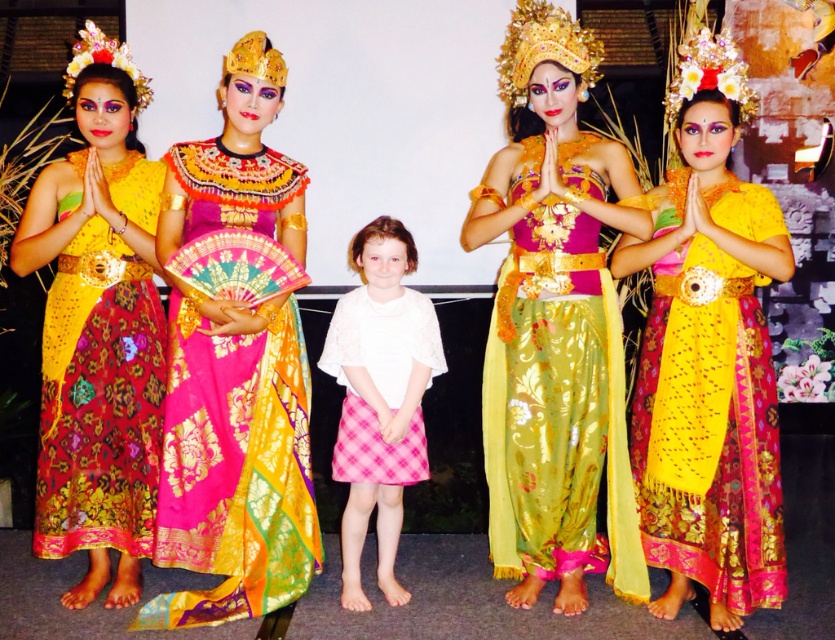
Question: Is matte gold fabric dress at left smaller than matte yellow fabric dress at center?

Choices:
 (A) no
 (B) yes

Answer: (A)

Question: Is shiny silk dress at center positioned at the back of matte gold fabric dress at left?

Choices:
 (A) yes
 (B) no

Answer: (B)

Question: Is the position of shiny silk dress at center more distant than that of matte gold fabric dress at left?

Choices:
 (A) yes
 (B) no

Answer: (B)

Question: Which point is farther from the camera taking this photo?

Choices:
 (A) (357, 380)
 (B) (61, 406)

Answer: (A)

Question: Considering the real-world distances, which object is farthest from the matte gold fabric dress at left?

Choices:
 (A) pink plaid skirt at center
 (B) shiny silk dress at center

Answer: (A)

Question: Among these objects, which one is farthest from the camera?

Choices:
 (A) pink plaid skirt at center
 (B) matte gold fabric dress at left

Answer: (A)